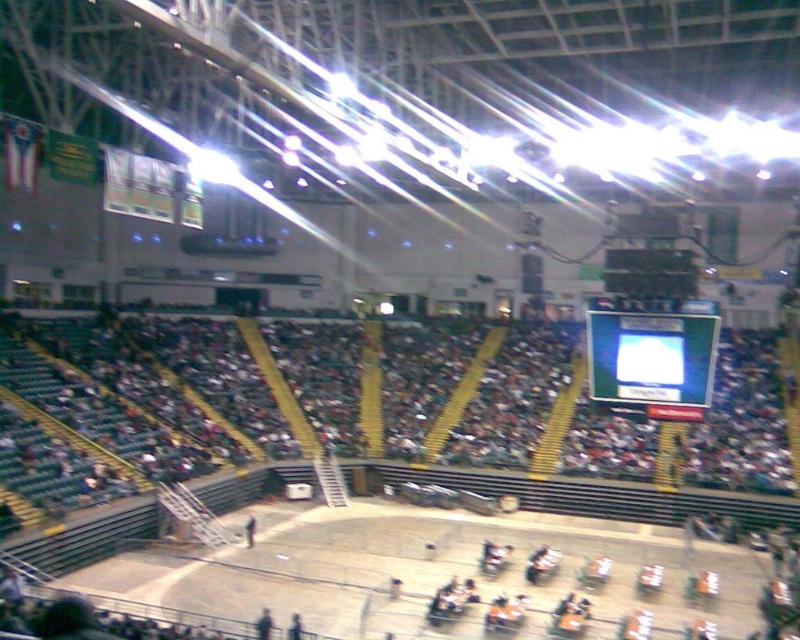
Question: Does dark gray seats at center have a larger size compared to black glossy scoreboard at upper center?

Choices:
 (A) yes
 (B) no

Answer: (A)

Question: Which point appears farthest from the camera in this image?

Choices:
 (A) (604, 269)
 (B) (440, 392)
 (C) (662, 376)

Answer: (A)

Question: Which object is the closest to the dark gray seats at center?

Choices:
 (A) matte black scoreboard at upper center
 (B) black glossy scoreboard at upper center

Answer: (A)

Question: Which object is closer to the camera taking this photo?

Choices:
 (A) matte black scoreboard at upper center
 (B) black glossy scoreboard at upper center
 (C) dark gray seats at center

Answer: (A)

Question: Is the position of matte black scoreboard at upper center more distant than that of black glossy scoreboard at upper center?

Choices:
 (A) no
 (B) yes

Answer: (A)

Question: Is dark gray seats at center positioned before black glossy scoreboard at upper center?

Choices:
 (A) no
 (B) yes

Answer: (B)